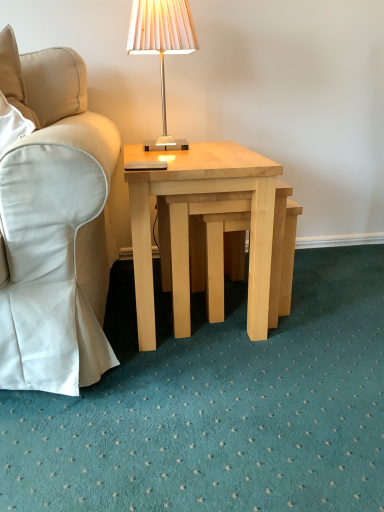
Question: Considering the relative positions of beige fabric chair at left and matte white lampshade at upper center in the image provided, is beige fabric chair at left behind matte white lampshade at upper center?

Choices:
 (A) no
 (B) yes

Answer: (A)

Question: Can you confirm if beige fabric chair at left is bigger than matte white lampshade at upper center?

Choices:
 (A) yes
 (B) no

Answer: (A)

Question: Does beige fabric chair at left appear on the left side of matte white lampshade at upper center?

Choices:
 (A) no
 (B) yes

Answer: (B)

Question: Is beige fabric chair at left positioned before matte white lampshade at upper center?

Choices:
 (A) yes
 (B) no

Answer: (A)

Question: Is beige fabric chair at left completely or partially outside of matte white lampshade at upper center?

Choices:
 (A) no
 (B) yes

Answer: (B)

Question: Is beige fabric chair at left placed right next to matte white lampshade at upper center?

Choices:
 (A) yes
 (B) no

Answer: (B)

Question: Is the surface of light wood/natural wood coffee table at center in direct contact with light wood step stool at center?

Choices:
 (A) no
 (B) yes

Answer: (A)

Question: From the image's perspective, is light wood/natural wood coffee table at center under light wood step stool at center?

Choices:
 (A) yes
 (B) no

Answer: (B)

Question: From a real-world perspective, is light wood/natural wood coffee table at center positioned under light wood step stool at center based on gravity?

Choices:
 (A) no
 (B) yes

Answer: (A)

Question: Considering the relative sizes of light wood/natural wood coffee table at center and light wood step stool at center in the image provided, is light wood/natural wood coffee table at center taller than light wood step stool at center?

Choices:
 (A) no
 (B) yes

Answer: (B)

Question: Does light wood/natural wood coffee table at center have a smaller size compared to light wood step stool at center?

Choices:
 (A) no
 (B) yes

Answer: (A)

Question: Is light wood/natural wood coffee table at center shorter than light wood step stool at center?

Choices:
 (A) no
 (B) yes

Answer: (A)

Question: Can you confirm if light wood step stool at center is bigger than light wood/natural wood coffee table at center?

Choices:
 (A) no
 (B) yes

Answer: (A)